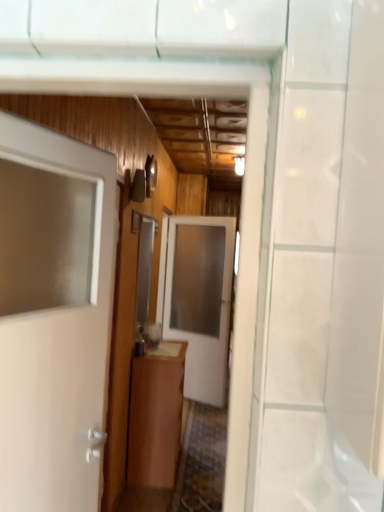
Question: Is brown wood cabinet at center inside the boundaries of white glossy door at center, arranged as the first door when viewed from the back, or outside?

Choices:
 (A) outside
 (B) inside

Answer: (A)

Question: In terms of width, does brown wood cabinet at center look wider or thinner when compared to white glossy door at center, the 2th door positioned from the front?

Choices:
 (A) thin
 (B) wide

Answer: (B)

Question: Which object is the farthest from the white glossy door at left, which is the 1th door in front-to-back order?

Choices:
 (A) white glossy door at center, arranged as the first door when viewed from the back
 (B) brown wood cabinet at center

Answer: (A)

Question: Which object is positioned closest to the brown wood cabinet at center?

Choices:
 (A) white glossy door at left, marked as the second door in a back-to-front arrangement
 (B) white glossy door at center, the 2th door positioned from the front

Answer: (B)